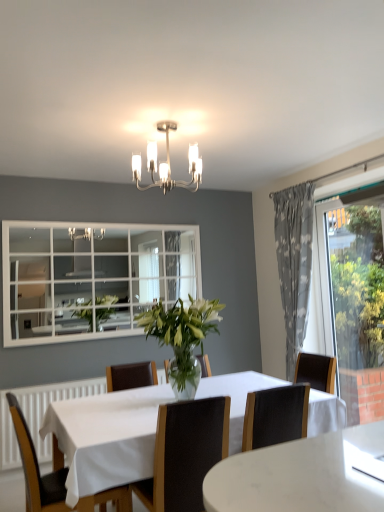
Question: Would you say white marble table at center is outside transparent glass window at right?

Choices:
 (A) no
 (B) yes

Answer: (B)

Question: Does white marble table at center have a larger size compared to transparent glass window at right?

Choices:
 (A) yes
 (B) no

Answer: (A)

Question: Is white marble table at center touching transparent glass window at right?

Choices:
 (A) yes
 (B) no

Answer: (B)

Question: Does white marble table at center have a greater height compared to transparent glass window at right?

Choices:
 (A) no
 (B) yes

Answer: (A)

Question: Is white marble table at center positioned in front of transparent glass window at right?

Choices:
 (A) no
 (B) yes

Answer: (B)

Question: Based on their sizes in the image, would you say gray fabric curtain at right is bigger or smaller than metallic chandelier at upper center?

Choices:
 (A) big
 (B) small

Answer: (A)

Question: From a real-world perspective, is gray fabric curtain at right positioned above or below metallic chandelier at upper center?

Choices:
 (A) below
 (B) above

Answer: (A)

Question: Looking at their shapes, would you say gray fabric curtain at right is wider or thinner than metallic chandelier at upper center?

Choices:
 (A) thin
 (B) wide

Answer: (A)

Question: In the image, is gray fabric curtain at right positioned in front of or behind metallic chandelier at upper center?

Choices:
 (A) front
 (B) behind

Answer: (B)

Question: In terms of height, does wooden chair at lower left, which appears as the second chair when viewed from the right, look taller or shorter compared to black leather chair at center, which ranks as the second chair in left-to-right order?

Choices:
 (A) short
 (B) tall

Answer: (B)

Question: Is wooden chair at lower left, marked as the 1th chair in a left-to-right arrangement, situated inside black leather chair at center, which ranks as the 1th chair in right-to-left order, or outside?

Choices:
 (A) inside
 (B) outside

Answer: (B)

Question: In the image, is wooden chair at lower left, marked as the 1th chair in a left-to-right arrangement, on the left side or the right side of black leather chair at center, which ranks as the second chair in left-to-right order?

Choices:
 (A) right
 (B) left

Answer: (B)

Question: From the image's perspective, is wooden chair at lower left, which appears as the second chair when viewed from the right, located above or below black leather chair at center, which ranks as the 1th chair in right-to-left order?

Choices:
 (A) below
 (B) above

Answer: (A)

Question: Do you think transparent glass window at right is within black leather chair at center, which ranks as the 1th chair in right-to-left order, or outside of it?

Choices:
 (A) inside
 (B) outside

Answer: (B)

Question: In terms of height, does transparent glass window at right look taller or shorter compared to black leather chair at center, which ranks as the 1th chair in right-to-left order?

Choices:
 (A) tall
 (B) short

Answer: (A)